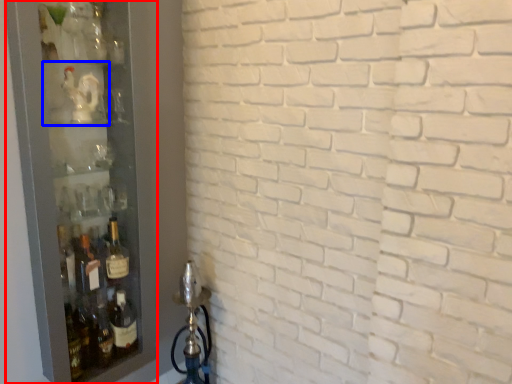
Question: Which point is closer to the camera, glass door (highlighted by a red box) or shelf (highlighted by a blue box)?

Choices:
 (A) glass door
 (B) shelf

Answer: (A)